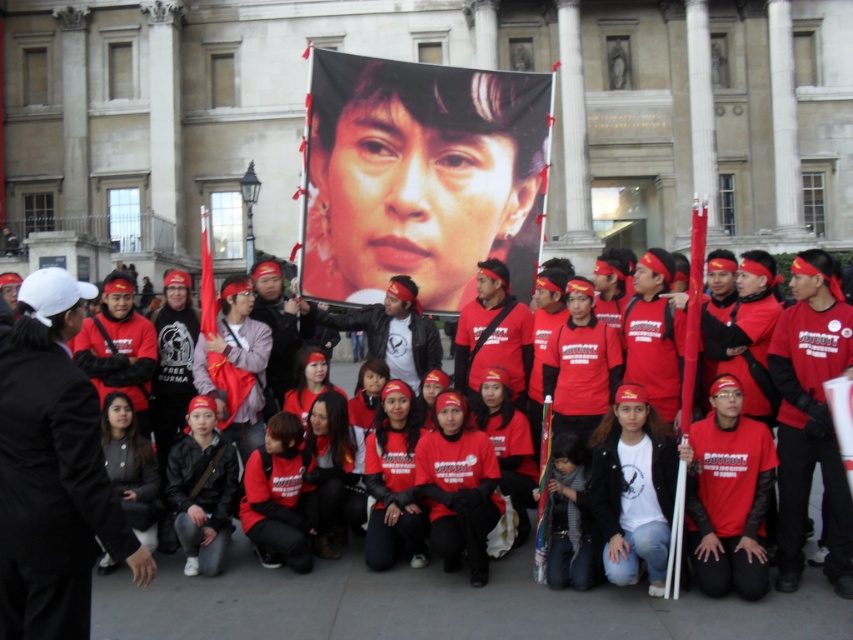
You are a photographer trying to capture the protest scene. You notice the matte black jacket at center and the matte red shirt at center. Which object is blocking your view of the other?

The matte black jacket at center is in front of the matte red shirt at center, so it is blocking the view of the matte red shirt at center.

You are a photographer trying to capture a clear photo of the matte black jacket at center without the matte black banner at upper center overlapping it. Based on their sizes and positions, is this possible?

The matte black banner at upper center has a larger size compared to matte black jacket at center. Since the banner is larger and positioned above the jacket, it might block the view. Adjusting the camera angle downward could help avoid overlap, but the banner may still partially obscure the jacket depending on distance and perspective.

You are a photographer at the protest scene. You need to capture a photo that includes both the matte black banner at upper center and the matte black jacket at center. Based on their positions, which object should you adjust your camera angle to focus on first to ensure both are in frame?

The matte black banner at upper center is located below the matte black jacket at center. To include both in the frame, focus on the matte black jacket at center first since it is higher up, then adjust the camera angle downward to include the banner below it.